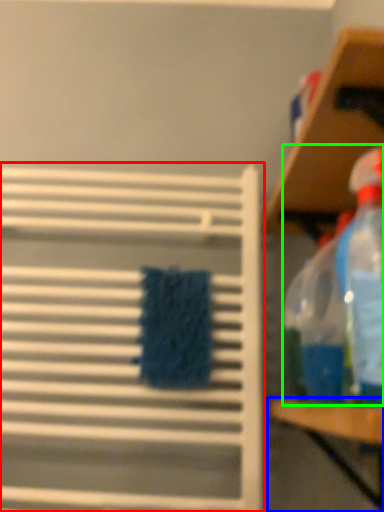
Question: Based on their relative distances, which object is farther from shelf (highlighted by a red box)? Choose from table (highlighted by a blue box) and cleaning product (highlighted by a green box).

Choices:
 (A) table
 (B) cleaning product

Answer: (A)